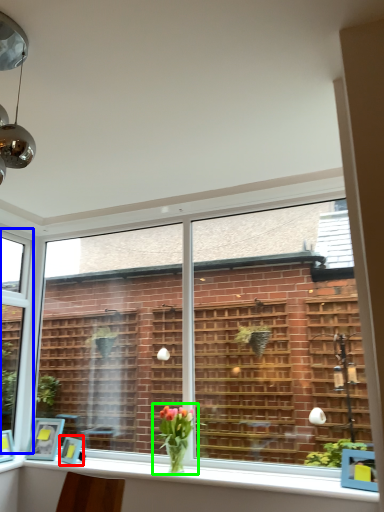
Question: Considering the real-world distances, which object is farthest from picture frame (highlighted by a red box)? window (highlighted by a blue box) or houseplant (highlighted by a green box)?

Choices:
 (A) window
 (B) houseplant

Answer: (A)